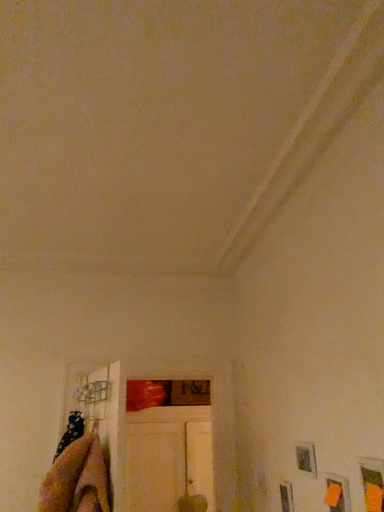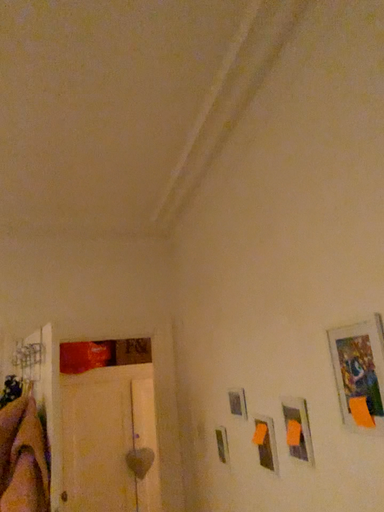
Question: Which way did the camera rotate in the video?

Choices:
 (A) rotated left
 (B) rotated right

Answer: (B)